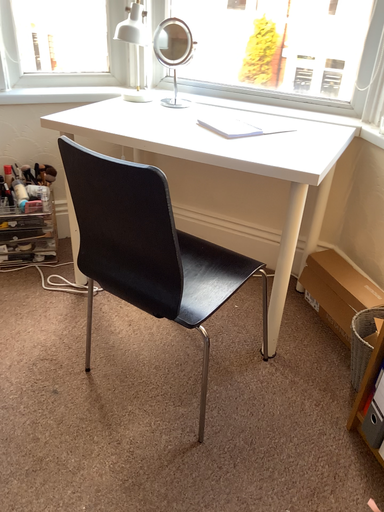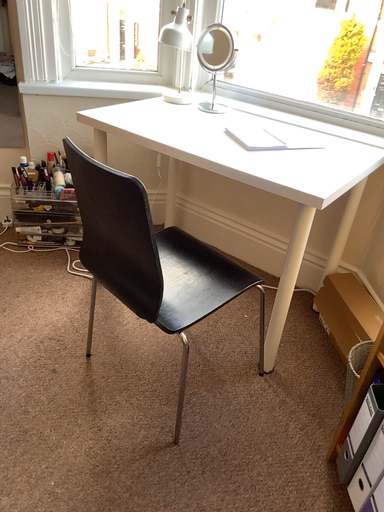
Question: How did the camera likely rotate when shooting the video?

Choices:
 (A) rotated right
 (B) rotated left

Answer: (B)